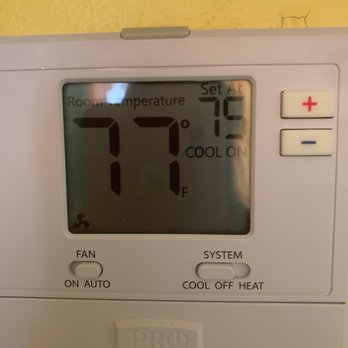
Where is `fan setting`? The height and width of the screenshot is (348, 348). fan setting is located at coordinates (86, 268).